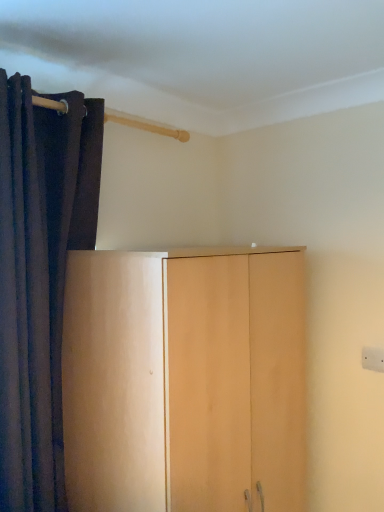
Question: From the image's perspective, would you say light wood cupboard at center is shown under dark velvet curtain at left?

Choices:
 (A) no
 (B) yes

Answer: (B)

Question: Is light wood cupboard at center oriented away from dark velvet curtain at left?

Choices:
 (A) yes
 (B) no

Answer: (B)

Question: Considering the relative sizes of light wood cupboard at center and dark velvet curtain at left in the image provided, is light wood cupboard at center wider than dark velvet curtain at left?

Choices:
 (A) no
 (B) yes

Answer: (B)

Question: Is light wood cupboard at center aimed at dark velvet curtain at left?

Choices:
 (A) no
 (B) yes

Answer: (A)

Question: Can you confirm if light wood cupboard at center is bigger than dark velvet curtain at left?

Choices:
 (A) no
 (B) yes

Answer: (B)

Question: Is light wood cupboard at center smaller than dark velvet curtain at left?

Choices:
 (A) yes
 (B) no

Answer: (B)

Question: Considering the relative positions of dark velvet curtain at left and light wood cupboard at center in the image provided, is dark velvet curtain at left to the right of light wood cupboard at center from the viewer's perspective?

Choices:
 (A) yes
 (B) no

Answer: (B)

Question: Is dark velvet curtain at left positioned far away from light wood cupboard at center?

Choices:
 (A) no
 (B) yes

Answer: (A)

Question: Considering the relative sizes of dark velvet curtain at left and light wood cupboard at center in the image provided, is dark velvet curtain at left thinner than light wood cupboard at center?

Choices:
 (A) yes
 (B) no

Answer: (A)

Question: Is the depth of dark velvet curtain at left less than that of light wood cupboard at center?

Choices:
 (A) yes
 (B) no

Answer: (B)

Question: Does dark velvet curtain at left have a lesser height compared to light wood cupboard at center?

Choices:
 (A) no
 (B) yes

Answer: (A)

Question: Considering the relative sizes of dark velvet curtain at left and light wood cupboard at center in the image provided, is dark velvet curtain at left bigger than light wood cupboard at center?

Choices:
 (A) yes
 (B) no

Answer: (B)

Question: In the image, is light wood cupboard at center on the left side or the right side of dark velvet curtain at left?

Choices:
 (A) left
 (B) right

Answer: (B)